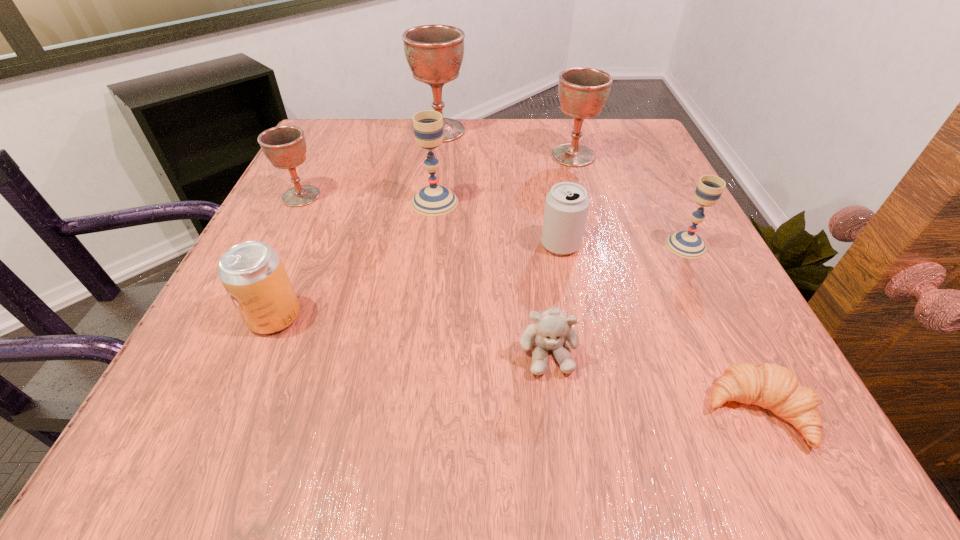
The width and height of the screenshot is (960, 540). In the image, there is a desktop. What are the coordinates of `vacant area at the far edge` in the screenshot? It's located at (534, 145).

I want to click on free region at the near edge of the desktop, so click(468, 442).

This screenshot has width=960, height=540. What are the coordinates of `free space at the left edge of the desktop` in the screenshot? It's located at (343, 239).

Where is `vacant space at the right edge of the desktop`? Image resolution: width=960 pixels, height=540 pixels. vacant space at the right edge of the desktop is located at coordinates (618, 233).

This screenshot has height=540, width=960. What are the coordinates of `vacant space at the far left corner of the desktop` in the screenshot? It's located at click(x=337, y=121).

You are a GUI agent. You are given a task and a screenshot of the screen. Output one action in this format:
    pyautogui.click(x=<x>, y=<y>)
    Task: Click on the vacant space at the near left corner
    
    Given the screenshot: What is the action you would take?
    click(x=146, y=437)

The width and height of the screenshot is (960, 540). Find the location of `empty space between the can and the left gray chalice`. empty space between the can and the left gray chalice is located at coordinates (497, 223).

Locate an element on the screen. vacant area between the pop (soda) and the biggest brown chalice is located at coordinates (357, 224).

Where is `vacant area that lies between the rightmost brown chalice and the left gray chalice`? The image size is (960, 540). vacant area that lies between the rightmost brown chalice and the left gray chalice is located at coordinates (504, 179).

The width and height of the screenshot is (960, 540). I want to click on free space between the farther gray chalice and the pop (soda), so click(354, 259).